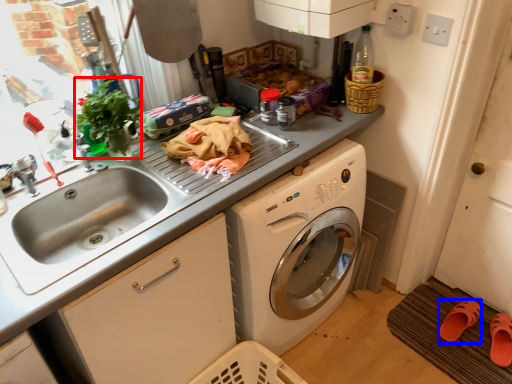
Question: Which point is further to the camera, plant (highlighted by a red box) or shoe (highlighted by a blue box)?

Choices:
 (A) plant
 (B) shoe

Answer: (B)